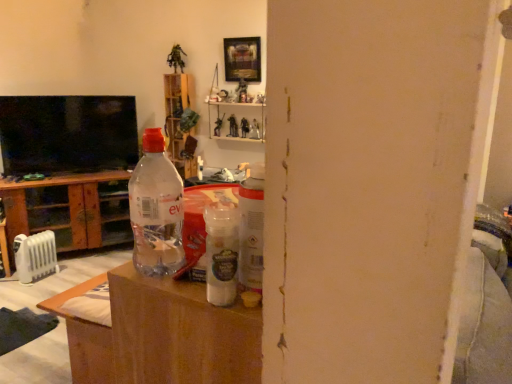
Question: From the image's perspective, is transparent plastic bottle at center positioned above or below white plastic radiator at lower left?

Choices:
 (A) above
 (B) below

Answer: (A)

Question: Would you say transparent plastic bottle at center is inside or outside white plastic radiator at lower left?

Choices:
 (A) outside
 (B) inside

Answer: (A)

Question: Estimate the real-world distances between objects in this image. Which object is farther from the black glossy tv at upper left?

Choices:
 (A) transparent plastic cabinet at left
 (B) transparent plastic bottle at center
 (C) wooden shelf at upper center
 (D) white plastic radiator at lower left
 (E) wooden picture frame at upper center

Answer: (B)

Question: Which object is the farthest from the black glossy tv at upper left?

Choices:
 (A) white plastic radiator at lower left
 (B) wooden picture frame at upper center
 (C) wooden shelf at upper center
 (D) transparent plastic cabinet at left
 (E) transparent plastic bottle at center

Answer: (E)